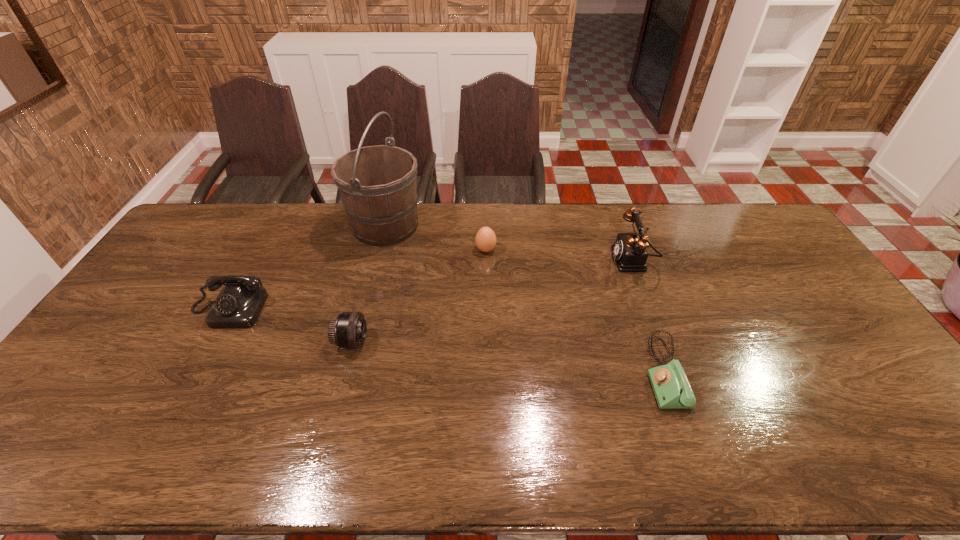
The width and height of the screenshot is (960, 540). In order to click on blank area located 0.350m on the front of the farthest telephone at the rotary dial in this screenshot , I will do `click(508, 261)`.

Where is `vacant space located on the front of the farthest telephone at the rotary dial`? The image size is (960, 540). vacant space located on the front of the farthest telephone at the rotary dial is located at coordinates (588, 261).

Find the location of a particular element. The image size is (960, 540). vacant region located 0.090m on the front of the farthest telephone at the rotary dial is located at coordinates (586, 261).

This screenshot has height=540, width=960. I want to click on vacant space located on the dial of the second farthest telephone, so click(158, 438).

This screenshot has width=960, height=540. In order to click on vacant space located 0.280m on the front-facing side of the telephoto lens in this screenshot , I will do `click(468, 342)`.

Where is `vacant space located 0.070m on the right of the boiled egg`? vacant space located 0.070m on the right of the boiled egg is located at coordinates (516, 250).

At what (x,y) coordinates should I click in order to perform the action: click on free space located 0.240m on the dial of the shortest telephone. Please return your answer as a coordinate pair (x, y). This screenshot has height=540, width=960. Looking at the image, I should click on click(555, 373).

Image resolution: width=960 pixels, height=540 pixels. I want to click on vacant region located 0.190m on the dial of the shortest telephone, so click(x=574, y=373).

Identify the location of vacant space located on the dial of the shortest telephone. The height and width of the screenshot is (540, 960). (604, 373).

The image size is (960, 540). In order to click on bucket located at the far edge in this screenshot , I will do `click(378, 185)`.